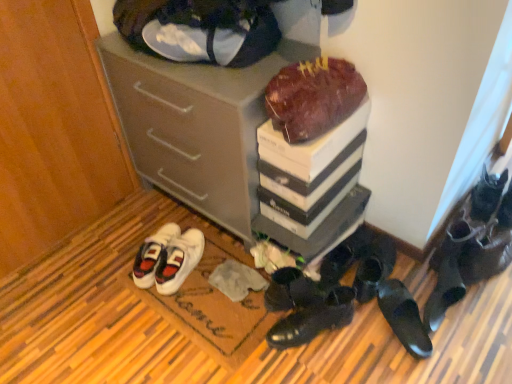
Locate an element on the screen. The image size is (512, 384). free spot to the right of black leather shoes at lower right, the 3th footwear viewed from the right is located at coordinates (489, 314).